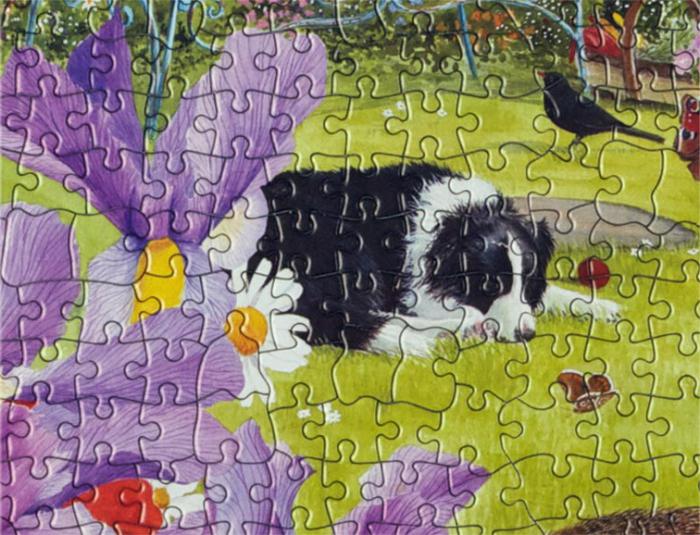
At what (x,y) coordinates should I click in order to perform the action: click on corner pieces. Please return your answer as a coordinate pair (x, y). Image resolution: width=700 pixels, height=535 pixels. Looking at the image, I should click on (10, 529), (689, 529), (690, 3), (5, 1).